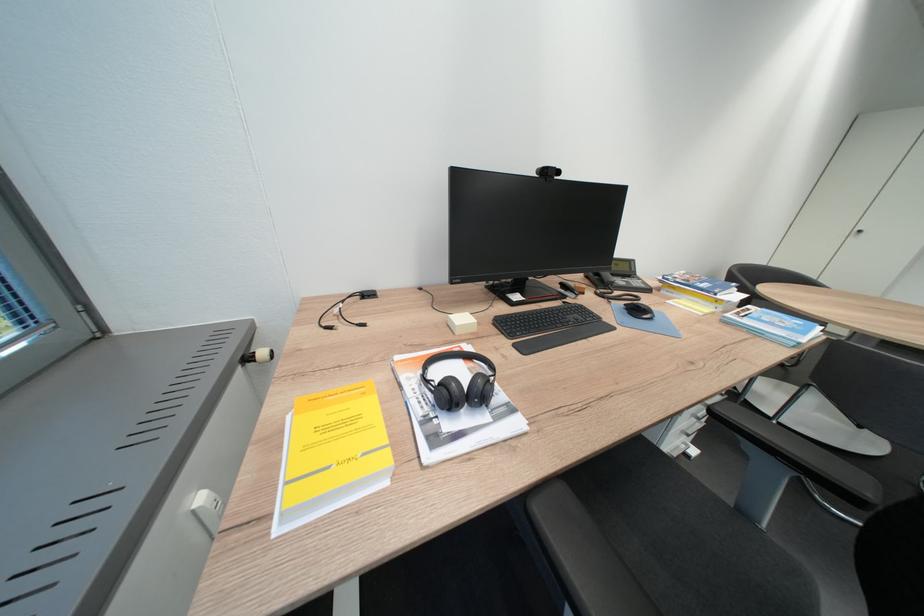
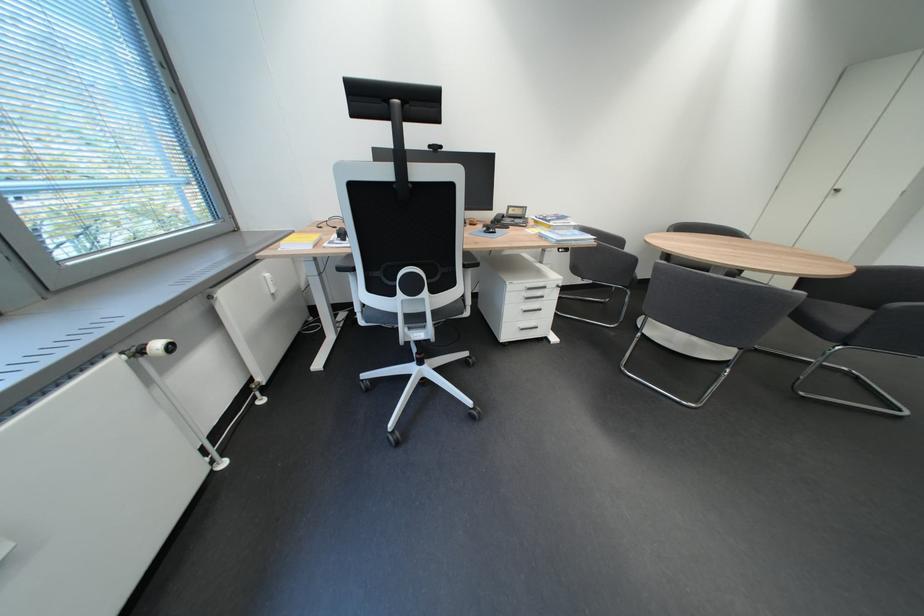
What movement of the cameraman would produce the second image?

The cameraman walked toward right, backward.